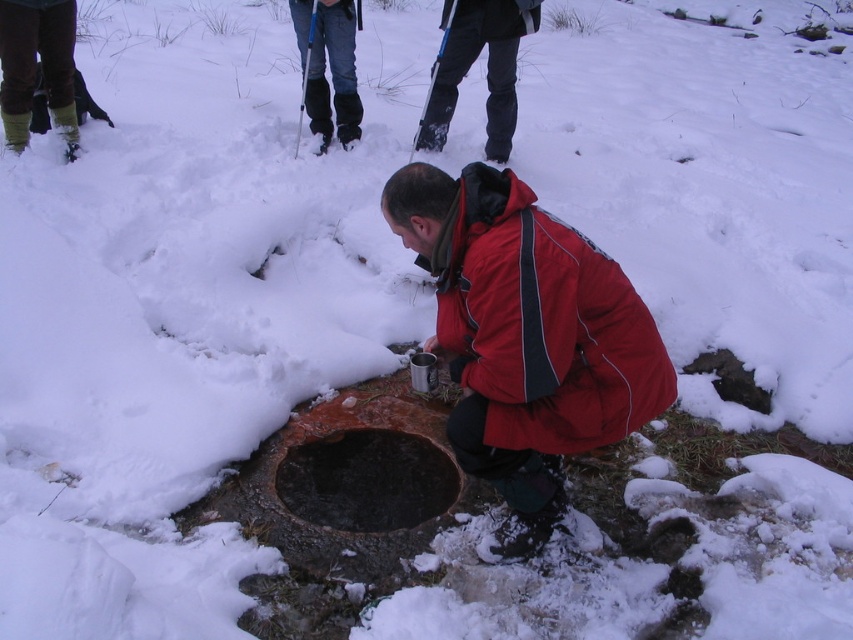
Can you confirm if red matte jacket at center is wider than rusty metal hole at lower center?

Correct, the width of red matte jacket at center exceeds that of rusty metal hole at lower center.

Between red matte jacket at center and rusty metal hole at lower center, which one is positioned lower?

rusty metal hole at lower center is below.

What do you see at coordinates (540, 323) in the screenshot?
I see `red matte jacket at center` at bounding box center [540, 323].

Where is `red matte jacket at center`? The height and width of the screenshot is (640, 853). red matte jacket at center is located at coordinates (540, 323).

Which is behind, point (438, 493) or point (480, 35)?

The point (480, 35) is behind.

Is dark brown stone hole at center taller than dark gray snow pants at upper center?

In fact, dark brown stone hole at center may be shorter than dark gray snow pants at upper center.

Which is behind, point (323, 480) or point (531, 19)?

The point (531, 19) is behind.

Locate an element on the screen. This screenshot has height=640, width=853. dark brown stone hole at center is located at coordinates (367, 481).

Is dark gray snow pants at upper center to the right of green rubber boots at upper left from the viewer's perspective?

Correct, you'll find dark gray snow pants at upper center to the right of green rubber boots at upper left.

Which is behind, point (462, 68) or point (27, 109)?

The point (462, 68) is behind.

Where is `dark gray snow pants at upper center`? dark gray snow pants at upper center is located at coordinates (486, 68).